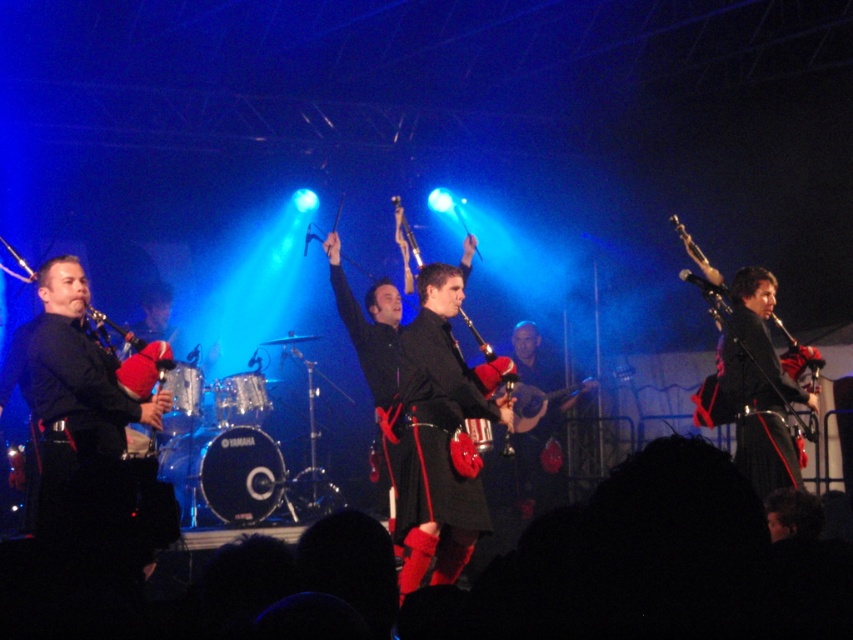
Question: Is black leather kilt at center positioned before matte black bagpipes at center?

Choices:
 (A) no
 (B) yes

Answer: (B)

Question: Estimate the real-world distances between objects in this image. Which object is farther from the black leather kilt at center?

Choices:
 (A) matte black bagpipes at right
 (B) matte black bagpipes at center

Answer: (B)

Question: Based on their relative distances, which object is farther from the matte black bagpipes at right?

Choices:
 (A) black leather kilt at center
 (B) matte black bagpipes at center

Answer: (B)

Question: Estimate the real-world distances between objects in this image. Which object is closer to the black leather kilt at center?

Choices:
 (A) matte black bagpipes at right
 (B) matte black bagpipes at center

Answer: (A)

Question: Can you confirm if black leather kilt at center is positioned below matte black bagpipes at center?

Choices:
 (A) no
 (B) yes

Answer: (A)

Question: Is matte black bagpipes at right further to camera compared to matte black bagpipes at center?

Choices:
 (A) yes
 (B) no

Answer: (B)